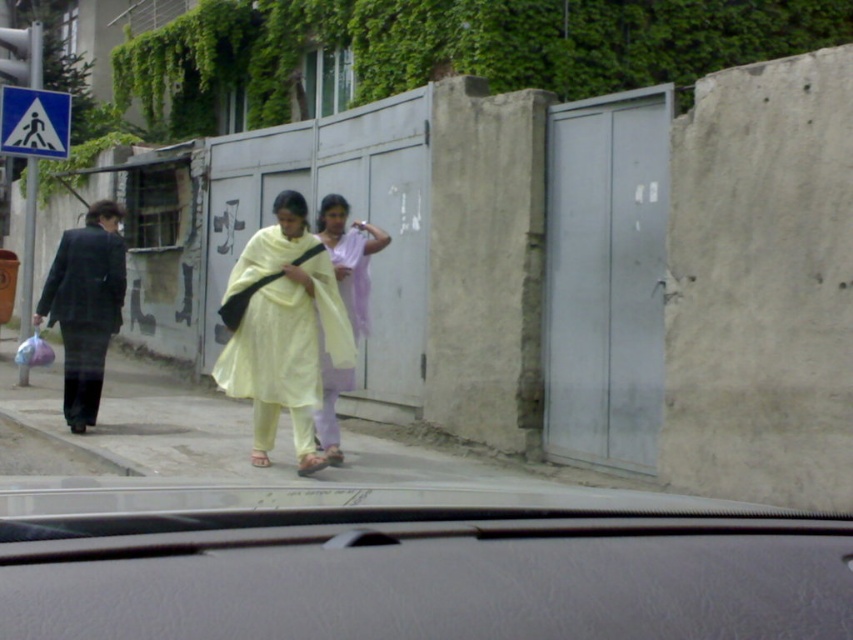
Can you confirm if light yellow fabric at center is bigger than matte black suit at left?

Correct, light yellow fabric at center is larger in size than matte black suit at left.

Is point (318, 400) behind point (94, 266)?

That is False.

This screenshot has width=853, height=640. Identify the location of light yellow fabric at center. (282, 330).

Locate an element on the screen. This screenshot has height=640, width=853. light yellow fabric at center is located at coordinates (282, 330).

Is light yellow fabric at center further to camera compared to light purple fabric at center?

No, light yellow fabric at center is closer to the viewer.

Does light yellow fabric at center have a lesser width compared to light purple fabric at center?

Incorrect, light yellow fabric at center's width is not less than light purple fabric at center's.

At what (x,y) coordinates should I click in order to perform the action: click on light yellow fabric at center. Please return your answer as a coordinate pair (x, y). The width and height of the screenshot is (853, 640). Looking at the image, I should click on (282, 330).

Can you confirm if matte black suit at left is shorter than light purple fabric at center?

No.

Is matte black suit at left above light purple fabric at center?

Actually, matte black suit at left is below light purple fabric at center.

The image size is (853, 640). What do you see at coordinates (85, 308) in the screenshot?
I see `matte black suit at left` at bounding box center [85, 308].

Find the location of a particular element. matte black suit at left is located at coordinates (85, 308).